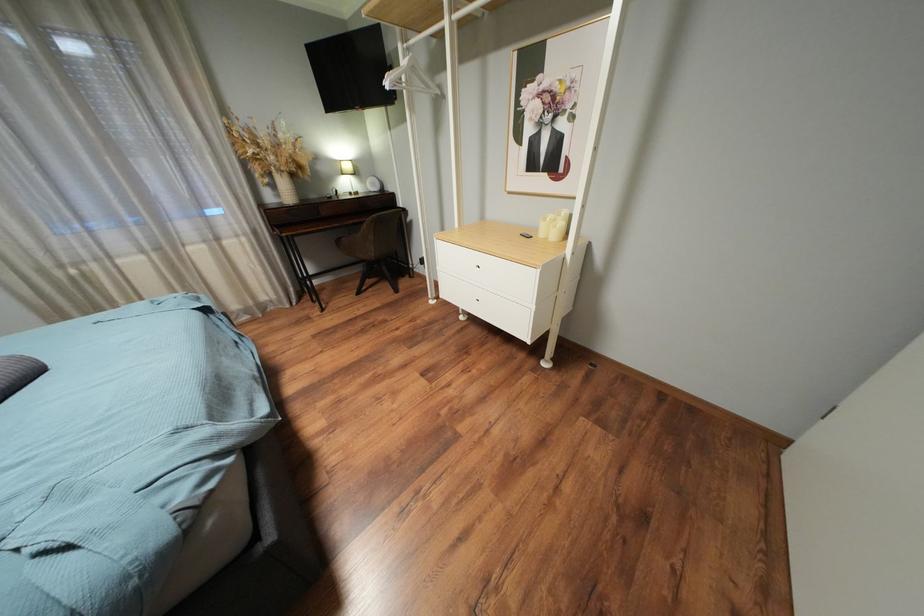
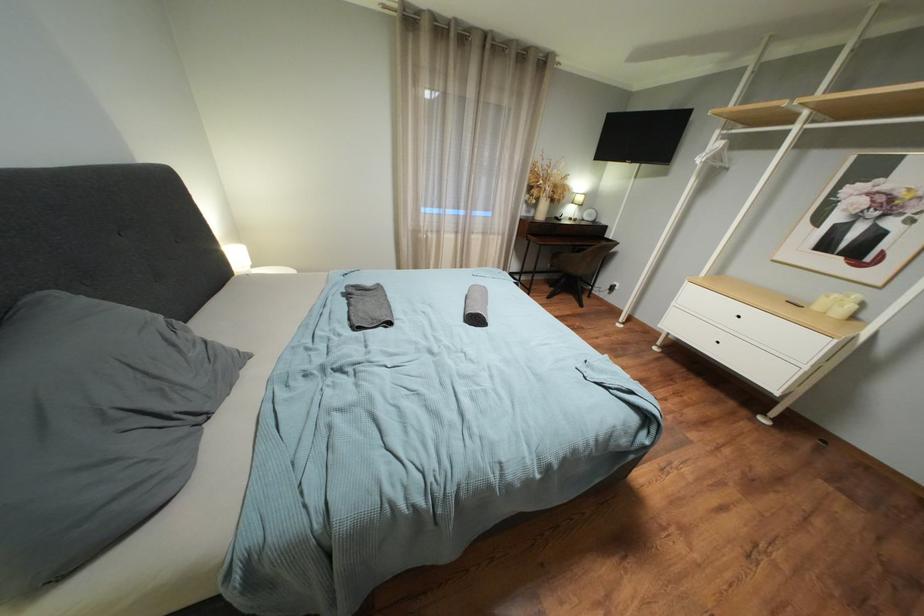
What movement of the cameraman would produce the second image?

The cameraman moved toward left, backward.